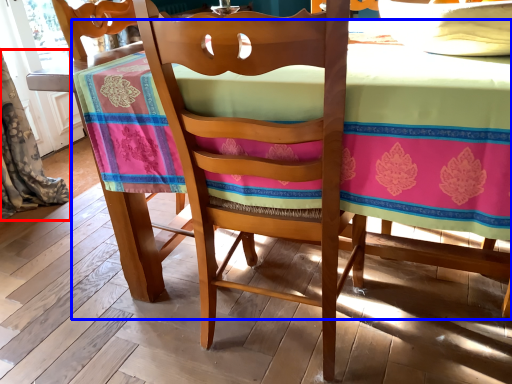
Question: Which point is further to the camera, curtain (highlighted by a red box) or table (highlighted by a blue box)?

Choices:
 (A) curtain
 (B) table

Answer: (A)